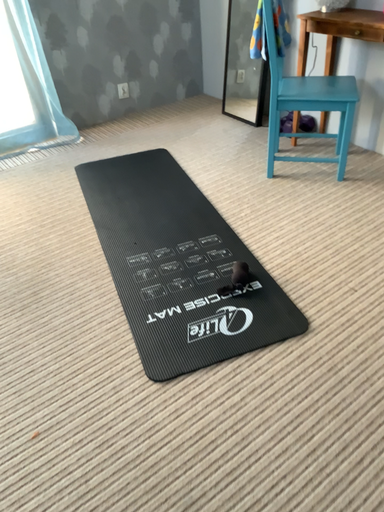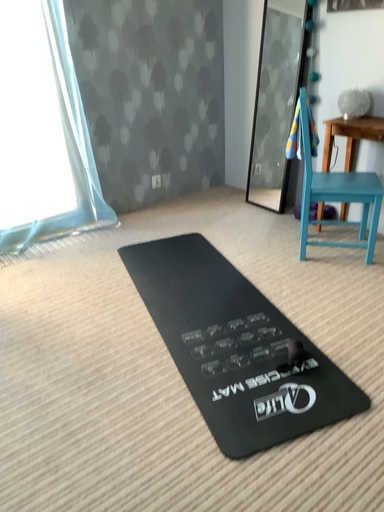
Question: Which way did the camera rotate in the video?

Choices:
 (A) rotated downward
 (B) rotated upward

Answer: (B)